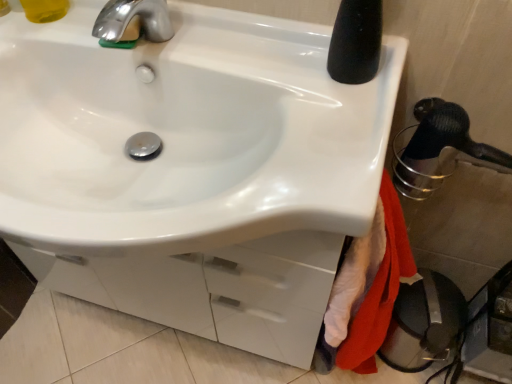
Question: In terms of height, does red cotton bath towel at lower right look taller or shorter compared to black rubber shower head at right?

Choices:
 (A) short
 (B) tall

Answer: (B)

Question: Relative to black rubber shower head at right, is red cotton bath towel at lower right in front or behind?

Choices:
 (A) front
 (B) behind

Answer: (A)

Question: Which is farther from the red cotton bath towel at lower right?

Choices:
 (A) white glossy sink at center
 (B) shiny metallic faucet at upper left
 (C) translucent yellow liquid at upper left
 (D) black rubber shower head at right

Answer: (C)

Question: Considering the real-world distances, which object is closest to the translucent yellow liquid at upper left?

Choices:
 (A) white glossy sink at center
 (B) black rubber shower head at right
 (C) shiny metallic faucet at upper left
 (D) red cotton bath towel at lower right

Answer: (C)